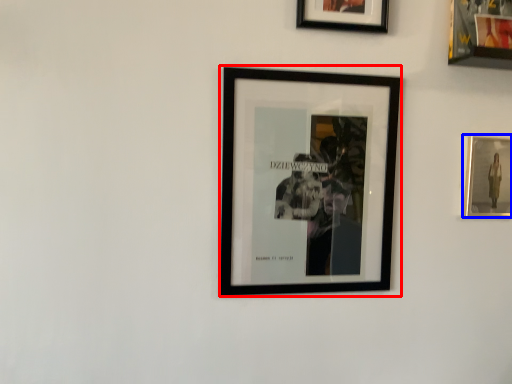
Question: Which of the following is the closest to the observer, picture frame (highlighted by a red box) or picture frame (highlighted by a blue box)?

Choices:
 (A) picture frame
 (B) picture frame

Answer: (A)